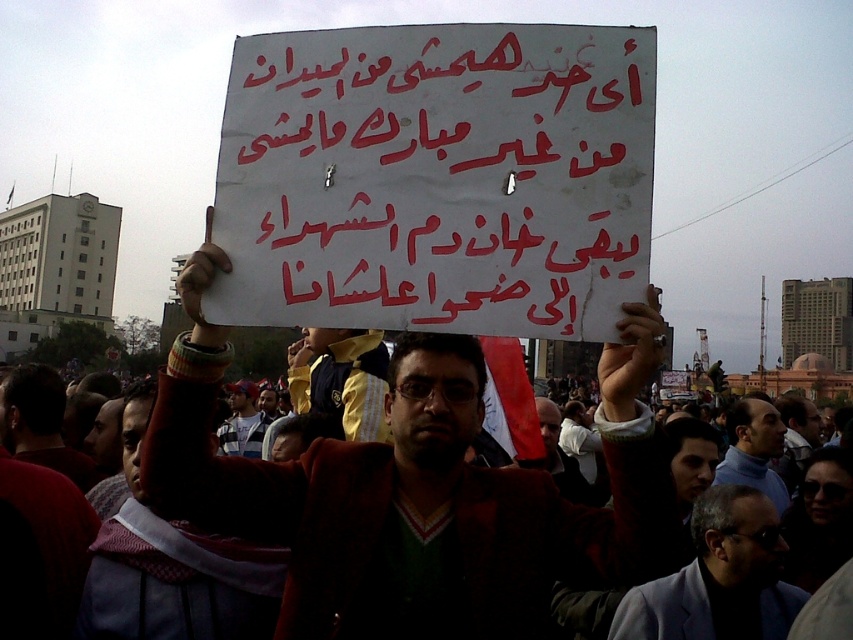
Question: Which point is farther from the camera taking this photo?

Choices:
 (A) (505, 134)
 (B) (200, 449)
 (C) (756, 435)

Answer: (C)

Question: Which point appears farthest from the camera in this image?

Choices:
 (A) (409, 38)
 (B) (393, 452)
 (C) (759, 515)

Answer: (C)

Question: Is white paper placard at center smaller than blue turtleneck sweater at center?

Choices:
 (A) yes
 (B) no

Answer: (A)

Question: Can you confirm if white paper placard at center is smaller than blue turtleneck sweater at center?

Choices:
 (A) yes
 (B) no

Answer: (A)

Question: Can you confirm if white paper placard at center is thinner than dark brown jacket at center?

Choices:
 (A) no
 (B) yes

Answer: (B)

Question: Which is nearer to the blue turtleneck sweater at center?

Choices:
 (A) white paper placard at center
 (B) dark brown jacket at center

Answer: (B)